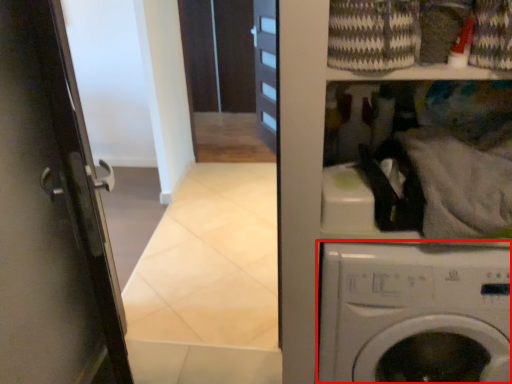
Question: From the image's perspective, where is washing machine (annotated by the red box) located relative to laundry?

Choices:
 (A) above
 (B) below

Answer: (B)